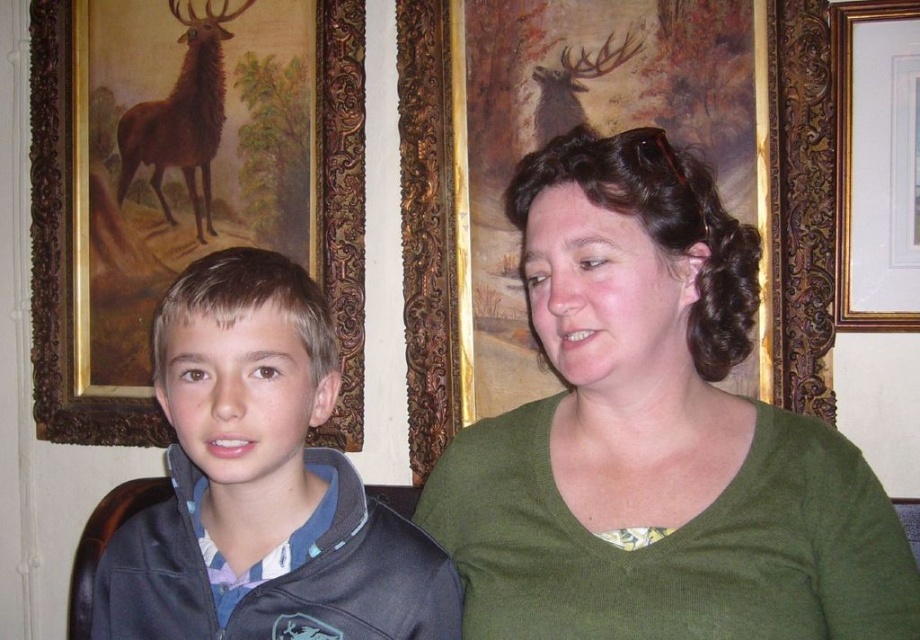
Consider the image. Does green matte shirt at center appear over gold ornate frame at upper center?

No, green matte shirt at center is not above gold ornate frame at upper center.

You are a GUI agent. You are given a task and a screenshot of the screen. Output one action in this format:
    pyautogui.click(x=<x>, y=<y>)
    Task: Click on the green matte shirt at center
    This screenshot has width=920, height=640.
    Given the screenshot: What is the action you would take?
    pyautogui.click(x=654, y=436)

The width and height of the screenshot is (920, 640). I want to click on green matte shirt at center, so (x=654, y=436).

Who is higher up, green matte shirt at center or gold ornate frame at upper right?

gold ornate frame at upper right is higher up.

Who is lower down, green matte shirt at center or gold ornate frame at upper right?

green matte shirt at center is below.

What do you see at coordinates (654, 436) in the screenshot? Image resolution: width=920 pixels, height=640 pixels. I see `green matte shirt at center` at bounding box center [654, 436].

Locate an element on the screen. This screenshot has height=640, width=920. green matte shirt at center is located at coordinates (654, 436).

Is point (362, 493) behind point (875, 120)?

No, it is in front of (875, 120).

Does blue plaid shirt at left have a lesser height compared to gold ornate frame at upper right?

Yes.

Is point (210, 508) closer to viewer compared to point (907, 326)?

Yes, point (210, 508) is closer to viewer.

At what (x,y) coordinates should I click in order to perform the action: click on blue plaid shirt at left. Please return your answer as a coordinate pair (x, y). The image size is (920, 640). Looking at the image, I should click on (261, 483).